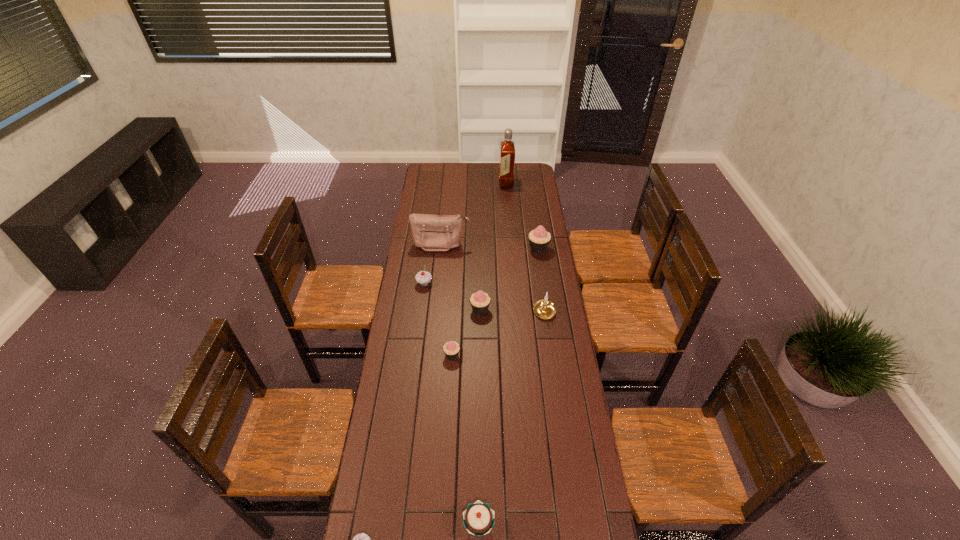
Where is `the leftmost pink cupcake`? The height and width of the screenshot is (540, 960). the leftmost pink cupcake is located at coordinates (451, 349).

Find the location of `the third nearest object`. the third nearest object is located at coordinates (451, 349).

You are a GUI agent. You are given a task and a screenshot of the screen. Output one action in this format:
    pyautogui.click(x=<x>, y=<y>)
    Task: Click on the free spot located on the front label of the farthest object
    This screenshot has width=960, height=540.
    Given the screenshot: What is the action you would take?
    pyautogui.click(x=471, y=184)

Identify the location of vacant space located 0.340m on the front label of the farthest object. (444, 184).

The image size is (960, 540). What are the coordinates of `free space located 0.050m on the front label of the farthest object` in the screenshot? It's located at (491, 184).

You are a GUI agent. You are given a task and a screenshot of the screen. Output one action in this format:
    pyautogui.click(x=<x>, y=<y>)
    Task: Click on the free region located 0.210m on the front pocket of the second tallest object
    
    Given the screenshot: What is the action you would take?
    pyautogui.click(x=438, y=282)

At what (x,y) coordinates should I click in order to perform the action: click on free space located on the back of the third tallest object. Please return your answer as a coordinate pair (x, y). This screenshot has width=960, height=540. Looking at the image, I should click on pyautogui.click(x=534, y=220).

Image resolution: width=960 pixels, height=540 pixels. I want to click on free spot located on the handle side of the candle holder, so pos(556,392).

Locate an element on the screen. The height and width of the screenshot is (540, 960). vacant space situated on the front of the fifth cupcake from right to left is located at coordinates (419, 326).

You are a GUI agent. You are given a task and a screenshot of the screen. Output one action in this format:
    pyautogui.click(x=<x>, y=<y>)
    Task: Click on the free space located 0.390m on the back of the second farthest pink cupcake
    The width and height of the screenshot is (960, 540).
    Given the screenshot: What is the action you would take?
    pyautogui.click(x=480, y=247)